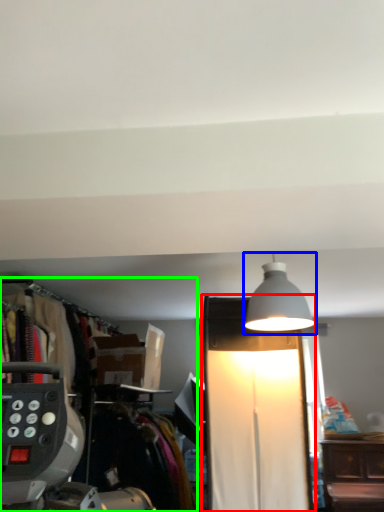
Question: Estimate the real-world distances between objects in this image. Which object is closer to lamp (highlighted by a red box), lamp (highlighted by a blue box) or closet (highlighted by a green box)?

Choices:
 (A) lamp
 (B) closet

Answer: (A)